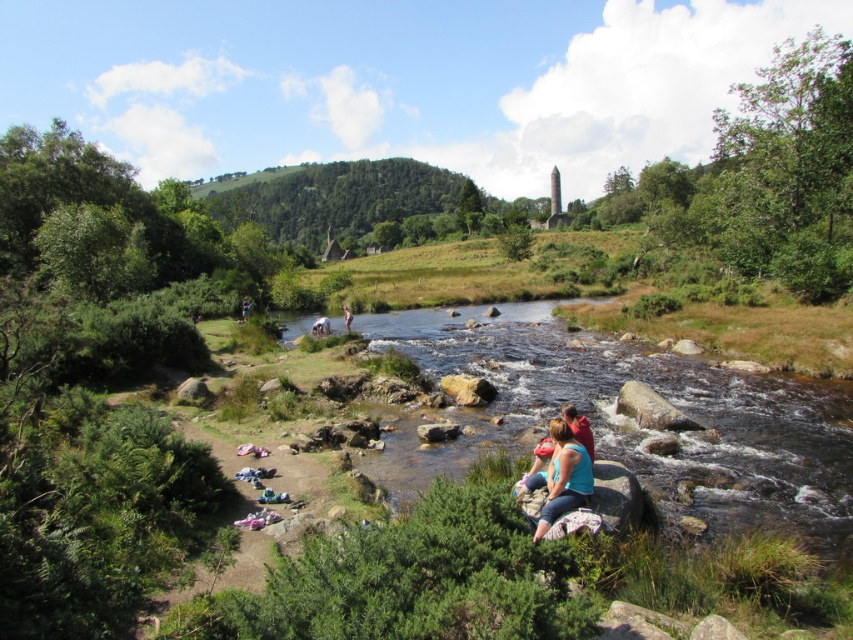
Between blue fabric at center and light brown wooden stick at center, which one has more height?

light brown wooden stick at center is taller.

Who is more forward, (553, 420) or (344, 324)?

Point (553, 420) is more forward.

Image resolution: width=853 pixels, height=640 pixels. What do you see at coordinates (561, 477) in the screenshot?
I see `blue fabric at center` at bounding box center [561, 477].

I want to click on blue fabric at center, so click(x=561, y=477).

Who is positioned more to the left, blue fabric at center or light brown fabric at river center?

light brown fabric at river center is more to the left.

Which is more to the right, blue fabric at center or light brown fabric at river center?

blue fabric at center is more to the right.

At what (x,y) coordinates should I click in order to perform the action: click on blue fabric at center. Please return your answer as a coordinate pair (x, y). The height and width of the screenshot is (640, 853). Looking at the image, I should click on (x=561, y=477).

Measure the distance between light brown fabric at river center and light brown wooden stick at center.

The distance of light brown fabric at river center from light brown wooden stick at center is 7.39 feet.

Is point (312, 330) farther from camera compared to point (344, 314)?

That is False.

What are the coordinates of `light brown fabric at river center` in the screenshot? It's located at (320, 326).

You are a GUI agent. You are given a task and a screenshot of the screen. Output one action in this format:
    pyautogui.click(x=<x>, y=<y>)
    Task: Click on the light brown fabric at river center
    This screenshot has height=640, width=853.
    Given the screenshot: What is the action you would take?
    pyautogui.click(x=320, y=326)